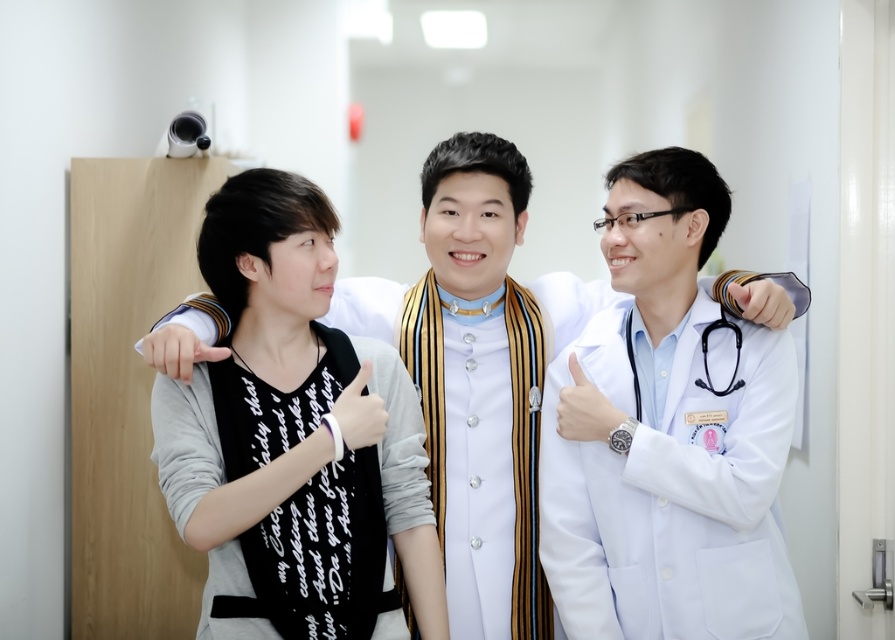
Does white matte lab coat at center come behind white matte watch at center?

That is False.

Can you confirm if white matte lab coat at center is smaller than white matte watch at center?

No.

Between point (777, 596) and point (558, 419), which one is positioned in front?

Point (777, 596)

At what (x,y) coordinates should I click in order to perform the action: click on white matte lab coat at center. Please return your answer as a coordinate pair (x, y). Looking at the image, I should click on (670, 435).

Who is positioned more to the right, white smooth lab coat at center or white matte watch at center?

Positioned to the right is white matte watch at center.

Does white smooth lab coat at center have a smaller size compared to white matte watch at center?

No.

The width and height of the screenshot is (895, 640). I want to click on white smooth lab coat at center, so click(448, 353).

This screenshot has width=895, height=640. Describe the element at coordinates (359, 412) in the screenshot. I see `white matte hand at center` at that location.

Between point (378, 403) and point (746, 308), which one is positioned behind?

Point (746, 308)

Locate an element on the screen. white matte hand at center is located at coordinates (359, 412).